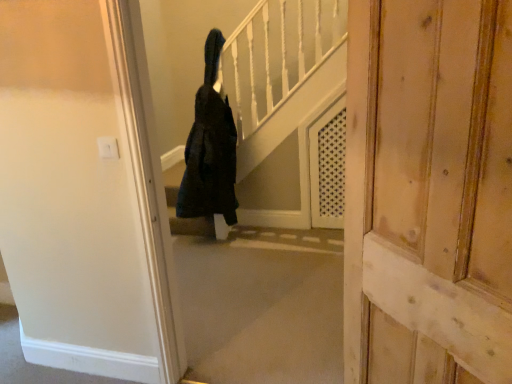
This screenshot has height=384, width=512. What do you see at coordinates (429, 192) in the screenshot? I see `wooden door at center` at bounding box center [429, 192].

The image size is (512, 384). What are the coordinates of `wooden door at center` in the screenshot? It's located at (429, 192).

Identify the location of black fuzzy coat at center. The height and width of the screenshot is (384, 512). (210, 148).

Describe the element at coordinates (210, 148) in the screenshot. I see `black fuzzy coat at center` at that location.

Locate an element on the screen. This screenshot has height=384, width=512. wooden door at center is located at coordinates (429, 192).

Is wooden door at center to the left of black fuzzy coat at center from the viewer's perspective?

In fact, wooden door at center is to the right of black fuzzy coat at center.

Based on the photo, between wooden door at center and black fuzzy coat at center, which one is positioned in front?

wooden door at center is closer to the camera.

Does point (442, 235) appear closer or farther from the camera than point (217, 34)?

Point (442, 235) appears to be closer to the viewer than point (217, 34).

From the image's perspective, is wooden door at center located above or below black fuzzy coat at center?

wooden door at center is situated lower than black fuzzy coat at center in the image.

From a real-world perspective, is wooden door at center on black fuzzy coat at center?

Yes, from a real-world perspective, wooden door at center is over black fuzzy coat at center

Considering the relative sizes of wooden door at center and black fuzzy coat at center in the image provided, is wooden door at center wider than black fuzzy coat at center?

In fact, wooden door at center might be narrower than black fuzzy coat at center.

Can you confirm if wooden door at center is taller than black fuzzy coat at center?

No, wooden door at center is not taller than black fuzzy coat at center.

Which of these two, wooden door at center or black fuzzy coat at center, is smaller?

Smaller between the two is black fuzzy coat at center.

Is wooden door at center not within black fuzzy coat at center?

Absolutely, wooden door at center is external to black fuzzy coat at center.

Is wooden door at center not close to black fuzzy coat at center?

Absolutely, wooden door at center is distant from black fuzzy coat at center.

Is wooden door at center aimed at black fuzzy coat at center?

No, wooden door at center does not turn towards black fuzzy coat at center.

Based on the photo, what's the angular difference between wooden door at center and black fuzzy coat at center's facing directions?

wooden door at center and black fuzzy coat at center are facing 48.1 degrees away from each other.

How much distance is there between wooden door at center and black fuzzy coat at center?

wooden door at center and black fuzzy coat at center are 2.06 meters apart from each other.

The width and height of the screenshot is (512, 384). Identify the location of person located behind the wooden door at center. (210, 148).

Consider the image. Between black fuzzy coat at center and wooden door at center, which one appears on the right side from the viewer's perspective?

From the viewer's perspective, wooden door at center appears more on the right side.

Based on the photo, considering their positions, is black fuzzy coat at center located in front of or behind wooden door at center?

Clearly, black fuzzy coat at center is behind wooden door at center.

Considering the points (186, 190) and (387, 223), which point is in front, point (186, 190) or point (387, 223)?

The point (387, 223) is closer to the camera.

From the image's perspective, is black fuzzy coat at center under wooden door at center?

Actually, black fuzzy coat at center appears above wooden door at center in the image.

Looking at this image, from a real-world perspective, is black fuzzy coat at center positioned under wooden door at center based on gravity?

Correct, in the physical world, black fuzzy coat at center is lower than wooden door at center.

Between black fuzzy coat at center and wooden door at center, which one has larger width?

black fuzzy coat at center.

Between black fuzzy coat at center and wooden door at center, which one has less height?

wooden door at center is shorter.

Which of these two, black fuzzy coat at center or wooden door at center, is bigger?

wooden door at center.

Would you say black fuzzy coat at center is outside wooden door at center?

black fuzzy coat at center is positioned outside wooden door at center.

Are black fuzzy coat at center and wooden door at center far apart?

Yes.

Does black fuzzy coat at center turn towards wooden door at center?

No, black fuzzy coat at center is not aimed at wooden door at center.

How many degrees apart are the facing directions of black fuzzy coat at center and wooden door at center?

There is a 48.1-degree angle between the facing directions of black fuzzy coat at center and wooden door at center.

How much distance is there between black fuzzy coat at center and wooden door at center?

The distance of black fuzzy coat at center from wooden door at center is 6.77 feet.

You are a GUI agent. You are given a task and a screenshot of the screen. Output one action in this format:
    pyautogui.click(x=<x>, y=<y>)
    Task: Click on the door below the black fuzzy coat at center (from the image's perspective)
    The height and width of the screenshot is (384, 512).
    Given the screenshot: What is the action you would take?
    pyautogui.click(x=429, y=192)

Identify the location of door above the black fuzzy coat at center (from a real-world perspective). The height and width of the screenshot is (384, 512). (429, 192).

Where is `person on the left side of wooden door at center`? Image resolution: width=512 pixels, height=384 pixels. person on the left side of wooden door at center is located at coordinates (210, 148).